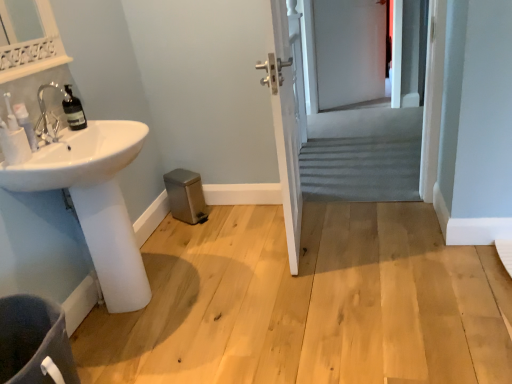
I want to click on free spot to the right of white wooden door at center, so click(375, 238).